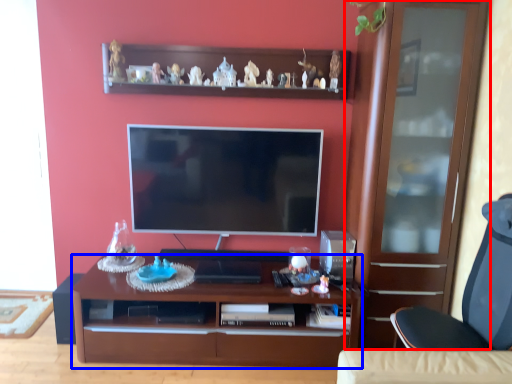
Question: Which object is further to the camera taking this photo, cabinetry (highlighted by a red box) or desk (highlighted by a blue box)?

Choices:
 (A) cabinetry
 (B) desk

Answer: (B)